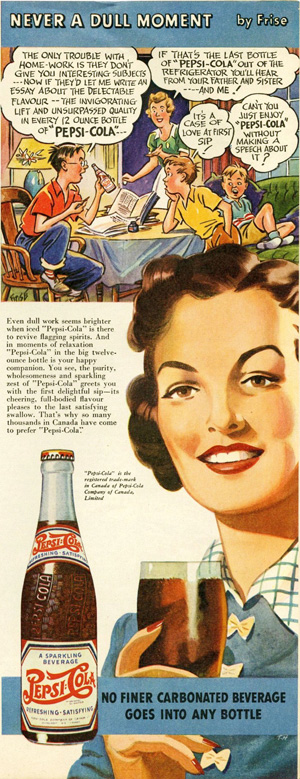
This screenshot has height=779, width=300. I want to click on light blue tablecloth, so click(x=134, y=256).